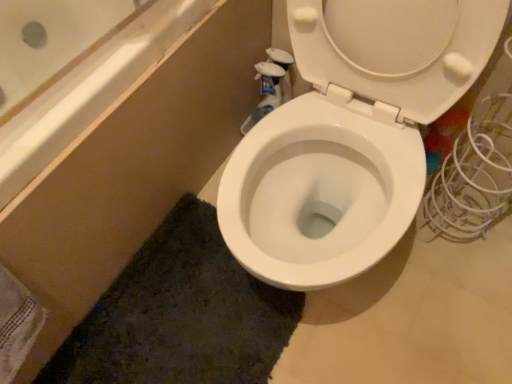
Question: Looking at their shapes, would you say dark green textured bath mat at lower center is wider or thinner than white textured towel at lower left?

Choices:
 (A) wide
 (B) thin

Answer: (A)

Question: From the image's perspective, relative to white textured towel at lower left, is dark green textured bath mat at lower center above or below?

Choices:
 (A) above
 (B) below

Answer: (B)

Question: Which object is the farthest from the white textured towel at lower left?

Choices:
 (A) dark green textured bath mat at lower center
 (B) white glossy toilet at center

Answer: (B)

Question: Considering the real-world distances, which object is closest to the dark green textured bath mat at lower center?

Choices:
 (A) white textured towel at lower left
 (B) white glossy toilet at center

Answer: (A)